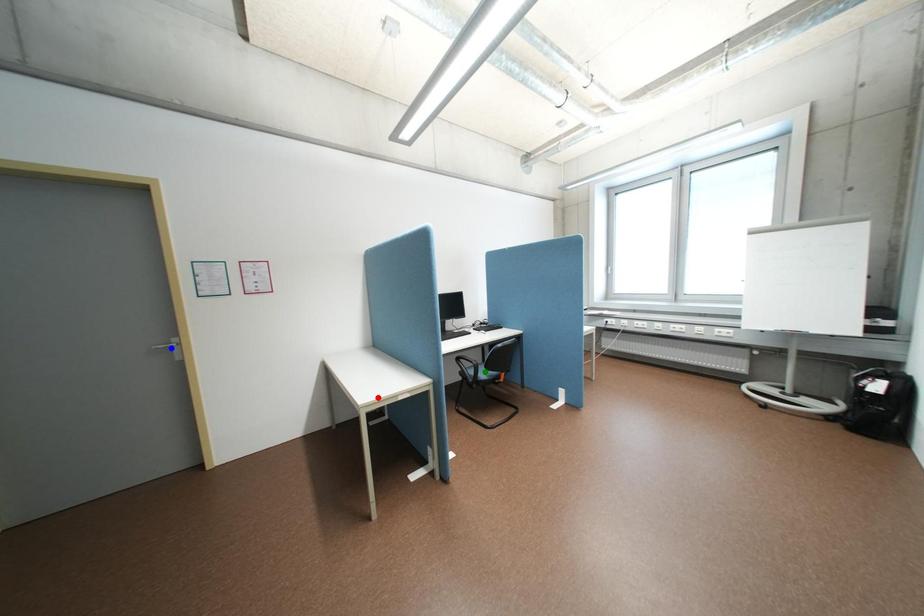
Order these from nearest to farthest:
- blue point
- red point
- green point

blue point → red point → green point